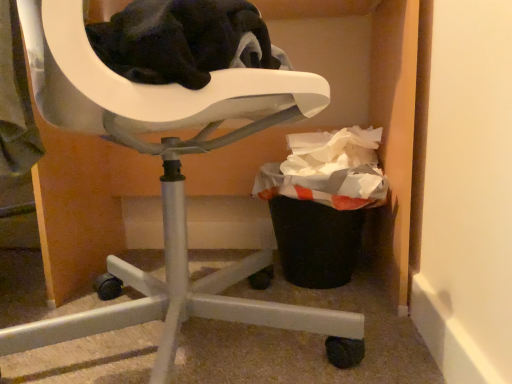
Question: Is white plastic chair at upper left further to the viewer compared to black plastic trash can at lower right?

Choices:
 (A) no
 (B) yes

Answer: (A)

Question: Can you confirm if white plastic chair at upper left is positioned to the left of black plastic trash can at lower right?

Choices:
 (A) no
 (B) yes

Answer: (B)

Question: From the image's perspective, is white plastic chair at upper left located beneath black plastic trash can at lower right?

Choices:
 (A) yes
 (B) no

Answer: (B)

Question: Is white plastic chair at upper left aimed at black plastic trash can at lower right?

Choices:
 (A) no
 (B) yes

Answer: (B)

Question: Would you consider white plastic chair at upper left to be distant from black plastic trash can at lower right?

Choices:
 (A) no
 (B) yes

Answer: (A)

Question: Considering the relative positions of white plastic chair at upper left and black plastic trash can at lower right in the image provided, is white plastic chair at upper left in front of black plastic trash can at lower right?

Choices:
 (A) yes
 (B) no

Answer: (A)

Question: Is the depth of black plastic trash can at lower right less than that of white plastic chair at upper left?

Choices:
 (A) no
 (B) yes

Answer: (A)

Question: Does black plastic trash can at lower right appear on the right side of white plastic chair at upper left?

Choices:
 (A) yes
 (B) no

Answer: (A)

Question: Is white plastic chair at upper left surrounded by black plastic trash can at lower right?

Choices:
 (A) yes
 (B) no

Answer: (B)

Question: Is black plastic trash can at lower right behind white plastic chair at upper left?

Choices:
 (A) no
 (B) yes

Answer: (B)

Question: Can you confirm if black plastic trash can at lower right is thinner than white plastic chair at upper left?

Choices:
 (A) yes
 (B) no

Answer: (A)

Question: Is black plastic trash can at lower right wider than white plastic chair at upper left?

Choices:
 (A) no
 (B) yes

Answer: (A)

Question: From a real-world perspective, is black plastic trash can at lower right above or below white plastic chair at upper left?

Choices:
 (A) above
 (B) below

Answer: (B)